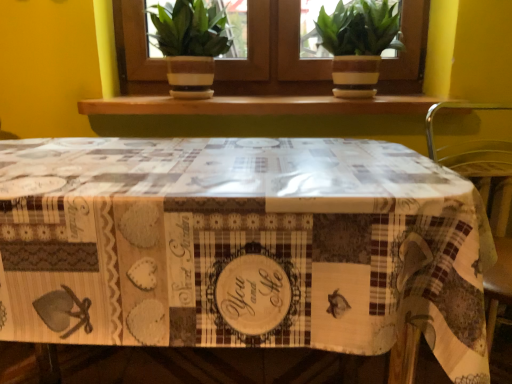
Question: From a real-world perspective, is printed fabric tablecloth at center over green leafy plant at upper center?

Choices:
 (A) yes
 (B) no

Answer: (B)

Question: Is printed fabric tablecloth at center not close to green leafy plant at upper center?

Choices:
 (A) yes
 (B) no

Answer: (B)

Question: Considering the relative sizes of printed fabric tablecloth at center and green leafy plant at upper center in the image provided, is printed fabric tablecloth at center taller than green leafy plant at upper center?

Choices:
 (A) yes
 (B) no

Answer: (A)

Question: Does printed fabric tablecloth at center appear on the right side of green leafy plant at upper center?

Choices:
 (A) no
 (B) yes

Answer: (A)

Question: From a real-world perspective, does printed fabric tablecloth at center sit lower than green leafy plant at upper center?

Choices:
 (A) no
 (B) yes

Answer: (B)

Question: Is printed fabric tablecloth at center thinner than green leafy plant at upper center?

Choices:
 (A) no
 (B) yes

Answer: (A)

Question: Does green leafy plant at upper center lie behind printed fabric tablecloth at center?

Choices:
 (A) no
 (B) yes

Answer: (B)

Question: Does green leafy plant at upper center have a larger size compared to printed fabric tablecloth at center?

Choices:
 (A) no
 (B) yes

Answer: (A)

Question: Can you confirm if green leafy plant at upper center is wider than printed fabric tablecloth at center?

Choices:
 (A) no
 (B) yes

Answer: (A)

Question: Can you confirm if green leafy plant at upper center is smaller than printed fabric tablecloth at center?

Choices:
 (A) yes
 (B) no

Answer: (A)

Question: Would you say green leafy plant at upper center is outside printed fabric tablecloth at center?

Choices:
 (A) yes
 (B) no

Answer: (A)

Question: Would you say green leafy plant at upper center contains printed fabric tablecloth at center?

Choices:
 (A) no
 (B) yes

Answer: (A)

Question: From a real-world perspective, is metallic green chair at right physically above green leafy plant at upper center?

Choices:
 (A) no
 (B) yes

Answer: (A)